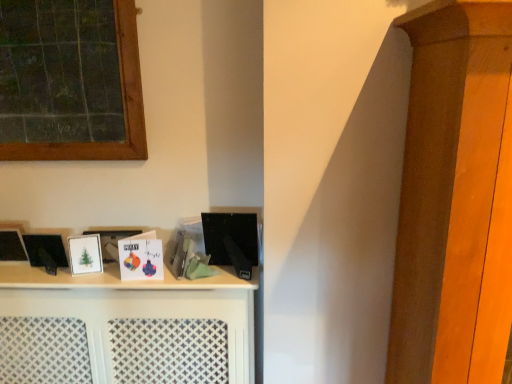
Image resolution: width=512 pixels, height=384 pixels. Describe the element at coordinates (85, 254) in the screenshot. I see `white matte picture frame at left` at that location.

Measure the distance between point (x=126, y=276) and camera.

Point (x=126, y=276) and camera are 1.50 meters apart.

Image resolution: width=512 pixels, height=384 pixels. What do you see at coordinates (141, 257) in the screenshot?
I see `matte paper card at center, the second book from the right` at bounding box center [141, 257].

What do you see at coordinates (123, 105) in the screenshot?
I see `green chalkboard at upper left` at bounding box center [123, 105].

In order to click on white matte shelf at center in this screenshot , I will do `click(124, 328)`.

Identify the location of white matte picture frame at left. (85, 254).

Is green chalkboard at upper left wider than matte black book at center, which appears as the first book when viewed from the right?

Incorrect, the width of green chalkboard at upper left does not surpass that of matte black book at center, which appears as the first book when viewed from the right.

In the scene shown: Is green chalkboard at upper left directly adjacent to matte black book at center, which is the 2th book from left to right?

No, green chalkboard at upper left is not beside matte black book at center, which is the 2th book from left to right.

Relative to matte black book at center, which is the 2th book from left to right, is green chalkboard at upper left in front or behind?

Visually, green chalkboard at upper left is located in front of matte black book at center, which is the 2th book from left to right.

Is green chalkboard at upper left positioned with its back to matte black book at center, which appears as the first book when viewed from the right?

green chalkboard at upper left does not have its back to matte black book at center, which appears as the first book when viewed from the right.

Does white matte picture frame at left have a lesser height compared to matte paper card at center, the 1th book viewed from the left?

Indeed, white matte picture frame at left has a lesser height compared to matte paper card at center, the 1th book viewed from the left.

Considering the sizes of objects white matte picture frame at left and matte paper card at center, the 1th book viewed from the left, in the image provided, who is thinner, white matte picture frame at left or matte paper card at center, the 1th book viewed from the left,?

With smaller width is white matte picture frame at left.

From the image's perspective, which one is positioned lower, white matte picture frame at left or matte paper card at center, the second book from the right?

matte paper card at center, the second book from the right.

Is white matte picture frame at left next to matte paper card at center, the second book from the right?

white matte picture frame at left and matte paper card at center, the second book from the right, are not in contact.

In the scene shown: Which is more to the right, matte black book at center, which is the 2th book from left to right, or green chalkboard at upper left?

From the viewer's perspective, matte black book at center, which is the 2th book from left to right, appears more on the right side.

From the image's perspective, does matte black book at center, which is the 2th book from left to right, appear lower than green chalkboard at upper left?

Yes, from the image's perspective, matte black book at center, which is the 2th book from left to right, is below green chalkboard at upper left.

Does point (184, 248) lie behind point (59, 157)?

That is True.

Between white matte shelf at center and white matte picture frame at left, which one is positioned behind?

white matte picture frame at left is further away from the camera.

From the image's perspective, does white matte shelf at center appear lower than white matte picture frame at left?

Yes, from the image's perspective, white matte shelf at center is below white matte picture frame at left.

Would you say white matte shelf at center is inside or outside white matte picture frame at left?

white matte shelf at center is not enclosed by white matte picture frame at left.

Is matte black book at center, which appears as the first book when viewed from the right, positioned with its back to white matte shelf at center?

matte black book at center, which appears as the first book when viewed from the right, does not have its back to white matte shelf at center.

In the scene shown: Is matte black book at center, which appears as the first book when viewed from the right, in contact with white matte shelf at center?

matte black book at center, which appears as the first book when viewed from the right, and white matte shelf at center are not in contact.

Is point (188, 259) closer to viewer compared to point (149, 333)?

No, (188, 259) is behind (149, 333).

Does matte black book at center, which appears as the first book when viewed from the right, have a smaller size compared to white matte shelf at center?

Yes, matte black book at center, which appears as the first book when viewed from the right, is smaller than white matte shelf at center.

Based on the photo, can you confirm if white matte shelf at center is taller than green chalkboard at upper left?

Yes, white matte shelf at center is taller than green chalkboard at upper left.

From the image's perspective, which one is positioned higher, white matte shelf at center or green chalkboard at upper left?

green chalkboard at upper left is shown above in the image.

The width and height of the screenshot is (512, 384). What are the coordinates of `window that is above the white matte shelf at center (from a real-world perspective)` in the screenshot? It's located at click(123, 105).

From a real-world perspective, is white matte shelf at center physically above green chalkboard at upper left?

No, from a real-world perspective, white matte shelf at center is not on top of green chalkboard at upper left.

Where is `the 1st book below when counting from the green chalkboard at upper left (from the image's perspective)`? the 1st book below when counting from the green chalkboard at upper left (from the image's perspective) is located at coordinates (141, 257).

Which object is more forward, green chalkboard at upper left or matte paper card at center, the second book from the right?

Positioned in front is green chalkboard at upper left.

From a real-world perspective, which is physically above, green chalkboard at upper left or matte paper card at center, the second book from the right?

From a 3D spatial view, green chalkboard at upper left is above.

Considering the positions of point (4, 152) and point (133, 238), is point (4, 152) closer or farther from the camera than point (133, 238)?

Clearly, point (4, 152) is more distant from the camera than point (133, 238).

This screenshot has width=512, height=384. I want to click on the 2nd book directly beneath the green chalkboard at upper left (from a real-world perspective), so click(180, 252).

The width and height of the screenshot is (512, 384). I want to click on the 1st book positioned below the white matte picture frame at left (from the image's perspective), so click(141, 257).

Looking at the image, which one is located further to matte black book at center, which appears as the first book when viewed from the right, green chalkboard at upper left or matte paper card at center, the second book from the right?

green chalkboard at upper left is positioned further to the anchor matte black book at center, which appears as the first book when viewed from the right.

Which object lies further to the anchor point white matte picture frame at left, white matte shelf at center or matte paper card at center, the second book from the right?

white matte shelf at center is further to white matte picture frame at left.

From the image, which object appears to be nearer to white matte picture frame at left, matte paper card at center, the second book from the right, or matte black book at center, which appears as the first book when viewed from the right?

Based on the image, matte paper card at center, the second book from the right, appears to be nearer to white matte picture frame at left.

Estimate the real-world distances between objects in this image. Which object is further from white matte picture frame at left, matte paper card at center, the second book from the right, or white matte shelf at center?

white matte shelf at center.

From the image, which object appears to be nearer to white matte shelf at center, matte black book at center, which is the 2th book from left to right, or green chalkboard at upper left?

Based on the image, matte black book at center, which is the 2th book from left to right, appears to be nearer to white matte shelf at center.

Looking at the image, which one is located closer to white matte picture frame at left, green chalkboard at upper left or matte paper card at center, the second book from the right?

The object closer to white matte picture frame at left is matte paper card at center, the second book from the right.

Considering their positions, is matte paper card at center, the second book from the right, positioned closer to matte black book at center, which appears as the first book when viewed from the right, than white matte shelf at center?

Based on the image, matte paper card at center, the second book from the right, appears to be nearer to matte black book at center, which appears as the first book when viewed from the right.

From the image, which object appears to be nearer to matte black book at center, which appears as the first book when viewed from the right, white matte shelf at center or matte paper card at center, the second book from the right?

matte paper card at center, the second book from the right, is closer to matte black book at center, which appears as the first book when viewed from the right.

Locate an element on the screen. This screenshot has width=512, height=384. picture frame between green chalkboard at upper left and matte black book at center, which appears as the first book when viewed from the right, in the up-down direction is located at coordinates (85, 254).

Locate an element on the screen. book that lies between matte paper card at center, the second book from the right, and white matte shelf at center from top to bottom is located at coordinates (180, 252).

Where is `picture frame between green chalkboard at upper left and white matte shelf at center in the up-down direction`? picture frame between green chalkboard at upper left and white matte shelf at center in the up-down direction is located at coordinates (85, 254).

Locate an element on the screen. book that lies between green chalkboard at upper left and matte black book at center, which appears as the first book when viewed from the right, from top to bottom is located at coordinates (141, 257).